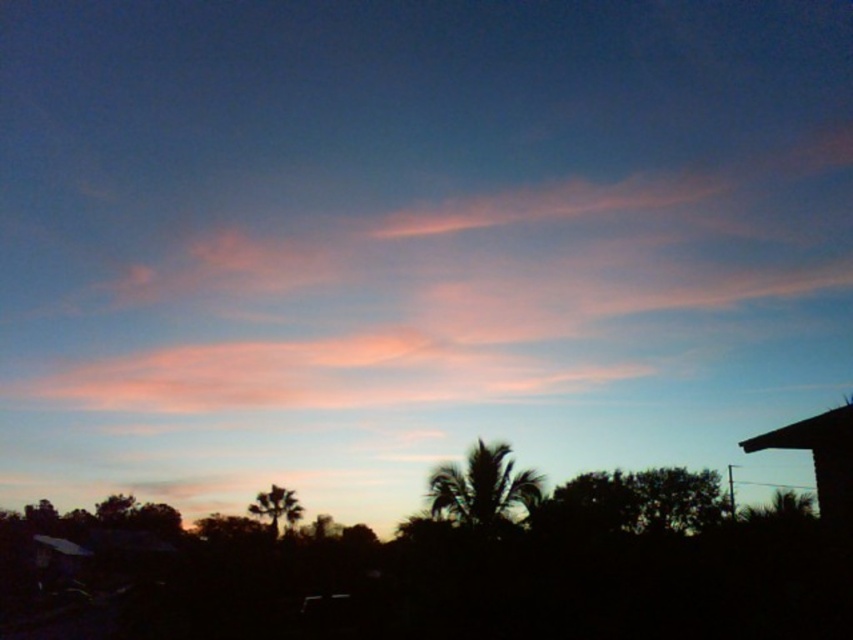
You are standing in the sunset scene and want to walk from point A to point B. Point A is at coordinates point (477,516) and point B is at coordinates point (277,518). Which point is closer to you when you look towards the horizon?

Point (477,516) is in front of point (277,518), so when looking towards the horizon, point (477,516) is closer to you.